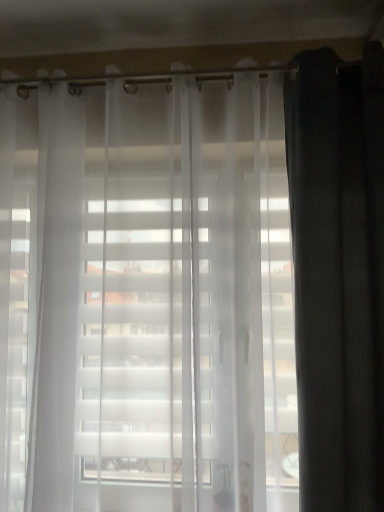
The height and width of the screenshot is (512, 384). I want to click on dark matte curtain at right, so click(x=338, y=275).

Describe the element at coordinates (338, 275) in the screenshot. I see `dark matte curtain at right` at that location.

Image resolution: width=384 pixels, height=512 pixels. I want to click on dark matte curtain at right, so click(x=338, y=275).